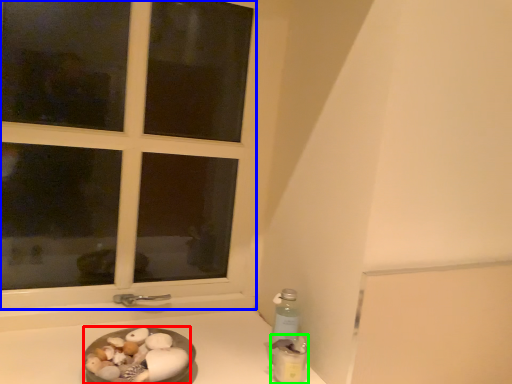
Question: Based on their relative distances, which object is farther from food (highlighted by a red box)? Choose from window (highlighted by a blue box) and bottle (highlighted by a green box).

Choices:
 (A) window
 (B) bottle

Answer: (A)